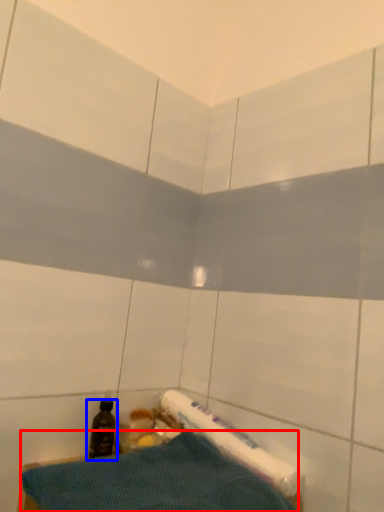
Question: Which point is closer to the camera, sheet (highlighted by a red box) or bottle (highlighted by a blue box)?

Choices:
 (A) sheet
 (B) bottle

Answer: (A)